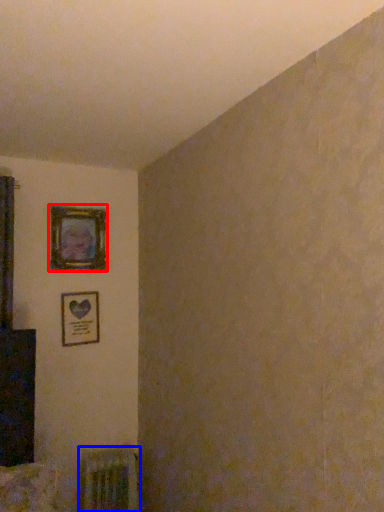
Question: Which object appears closest to the camera in this image, picture frame (highlighted by a red box) or radiator (highlighted by a blue box)?

Choices:
 (A) picture frame
 (B) radiator

Answer: (B)